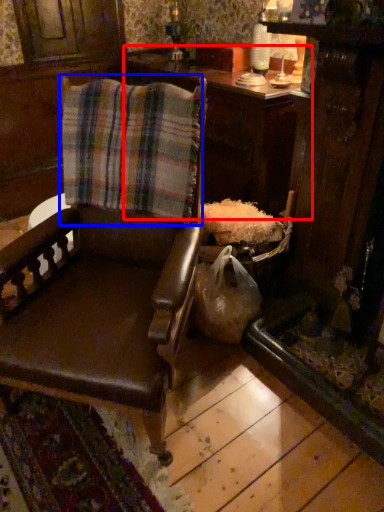
Question: Which object is closer to the camera taking this photo, table (highlighted by a red box) or flannel (highlighted by a blue box)?

Choices:
 (A) table
 (B) flannel

Answer: (B)